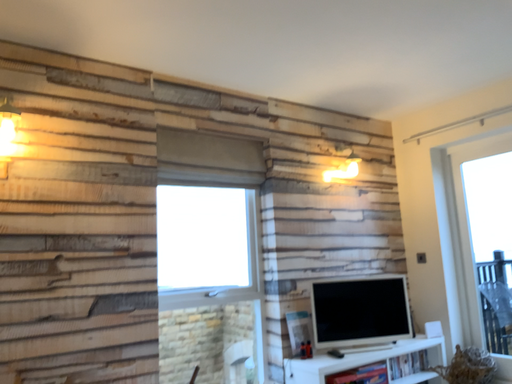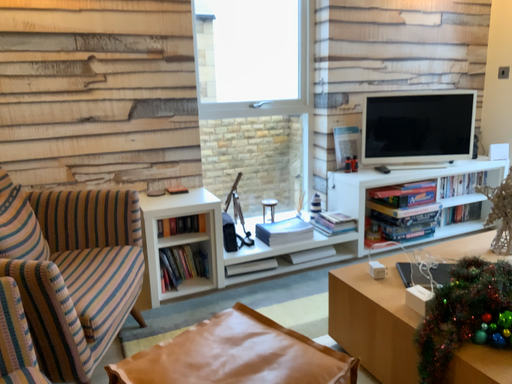
Question: How did the camera likely rotate when shooting the video?

Choices:
 (A) rotated right
 (B) rotated left

Answer: (B)